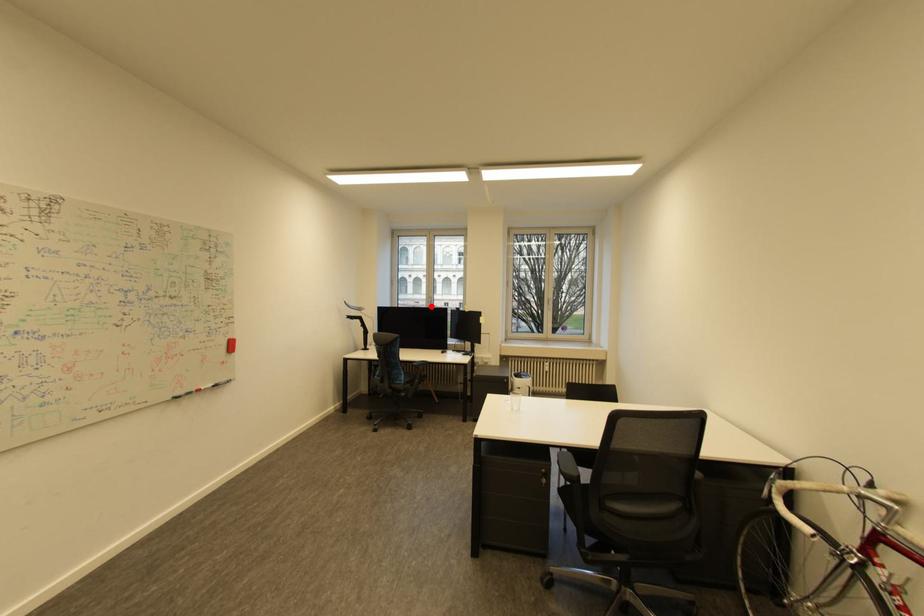
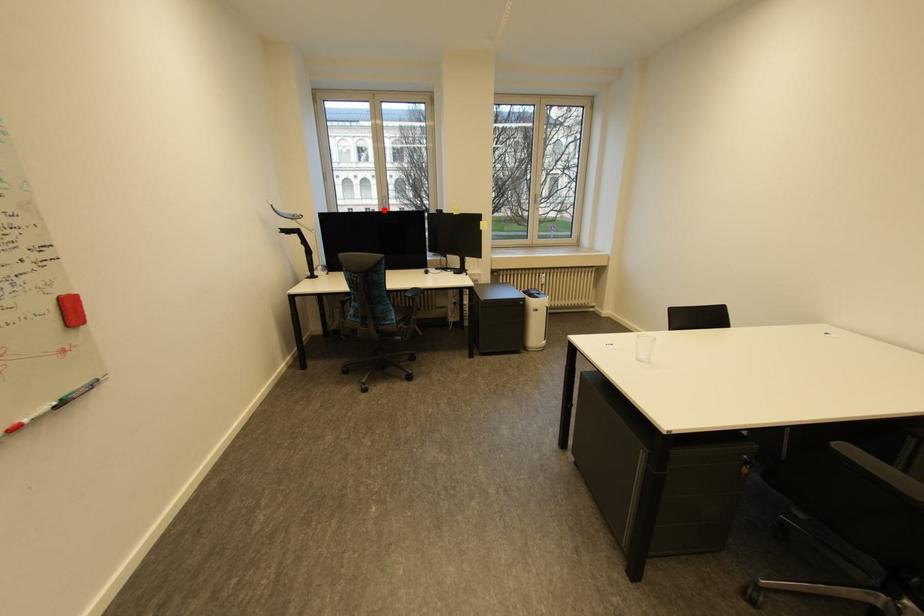
I am providing you with two images of the same scene from different viewpoints. A red point is marked on the first image and another point is marked on the second image. Is the red point in image1 aligned with the point shown in image2?

Yes